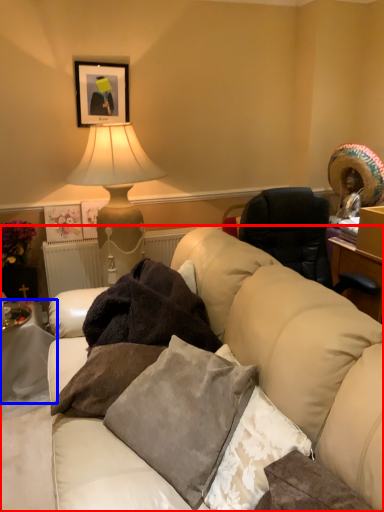
Question: Which of the following is the closest to the observer, studio couch (highlighted by a red box) or table (highlighted by a blue box)?

Choices:
 (A) studio couch
 (B) table

Answer: (A)